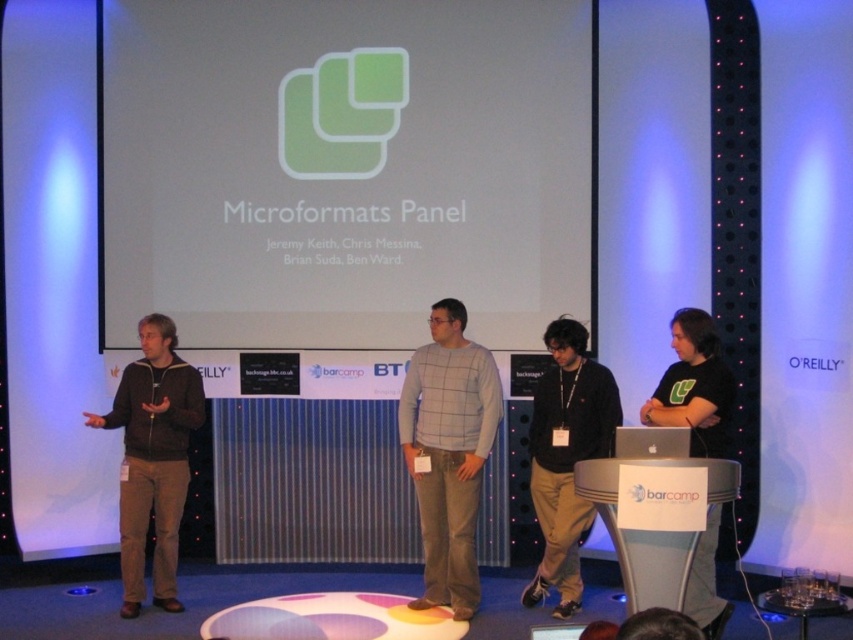
You are a photographer at the back of the room during the panel discussion. You want to take a photo that includes both the point at coordinates point (474, 355) and point (647, 429). Which point is closer to you, and will you need to adjust your focus to capture both clearly?

Point (474, 355) is closer to you than point (647, 429). Since the two points are at different distances, you may need to adjust your focus to ensure both are in clear view.

You are a photographer setting up for the panel discussion. You need to position a camera 4 feet away from the gray checkered sweater at center to capture the speaker clearly. Is the white matte projection screen at center in the camera frame if the camera is placed at the required distance?

The white matte projection screen at center is 3.72 feet away from the gray checkered sweater at center. Since the camera needs to be placed 4 feet away from the sweater, the screen is within the camera frame as it is closer than the required distance.